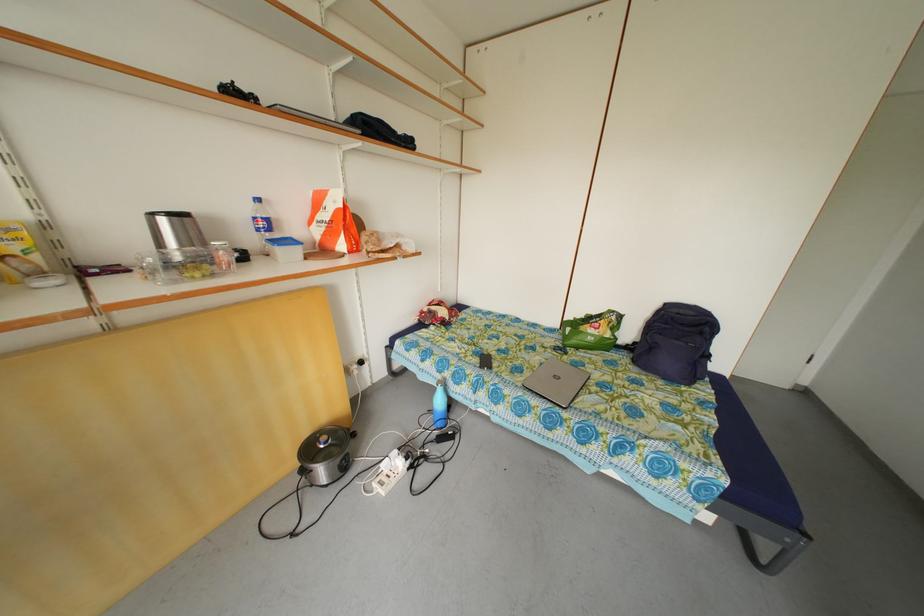
Find where to lift the orange paper bag. Please return your answer as a coordinate pair (x, y).

(332, 222)